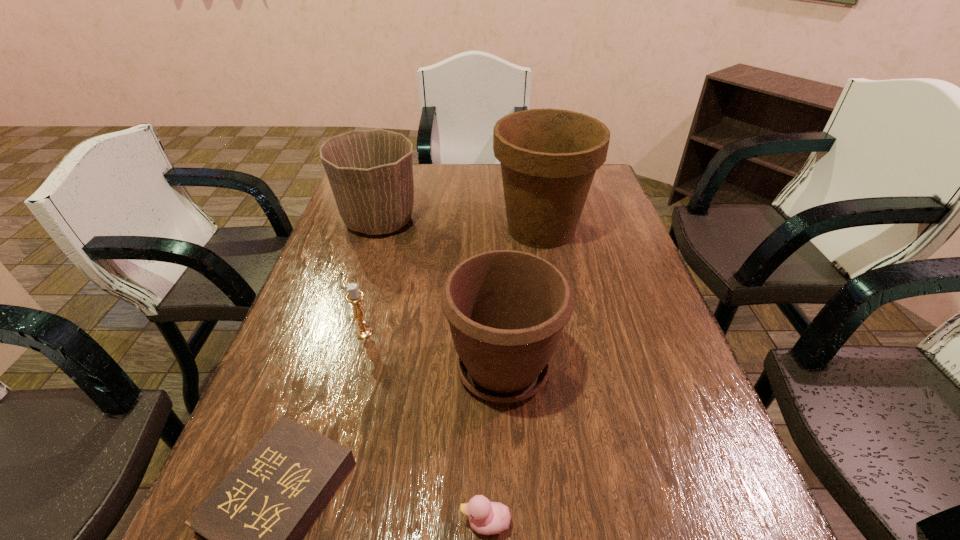
This screenshot has width=960, height=540. I want to click on the tallest flowerpot, so click(x=549, y=157).

What are the coordinates of `the leftmost flowerpot` in the screenshot? It's located at (370, 172).

The image size is (960, 540). Identify the location of the nearest flowerpot. (506, 309).

Image resolution: width=960 pixels, height=540 pixels. In order to click on the fourth tallest object in this screenshot , I will do `click(355, 296)`.

Locate an element on the screen. free space located 0.170m on the front of the tallest flowerpot is located at coordinates (554, 302).

Identify the location of vacant region located on the right of the leftmost flowerpot. This screenshot has width=960, height=540. (541, 221).

The image size is (960, 540). Identify the location of free region located 0.370m on the left of the nearest flowerpot. (276, 368).

Where is `free space located on the right of the third shortest object`? The height and width of the screenshot is (540, 960). free space located on the right of the third shortest object is located at coordinates (428, 333).

In order to click on flowerpot that is at the left edge in this screenshot , I will do `click(370, 172)`.

Identify the location of candle holder situated at the left edge. (355, 296).